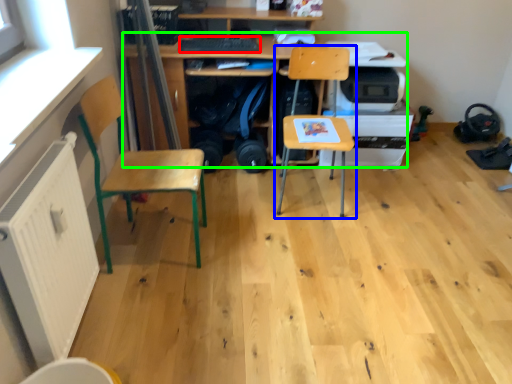
Question: Estimate the real-world distances between objects in this image. Which object is closer to keyboard (highlighted by a red box), chair (highlighted by a blue box) or desk (highlighted by a green box)?

Choices:
 (A) chair
 (B) desk

Answer: (B)